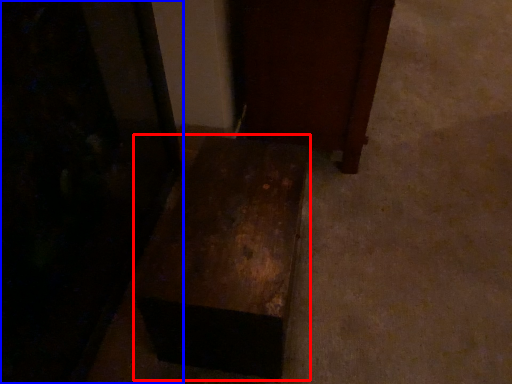
Question: Which object appears farthest to the camera in this image, furniture (highlighted by a red box) or furniture (highlighted by a blue box)?

Choices:
 (A) furniture
 (B) furniture

Answer: (A)